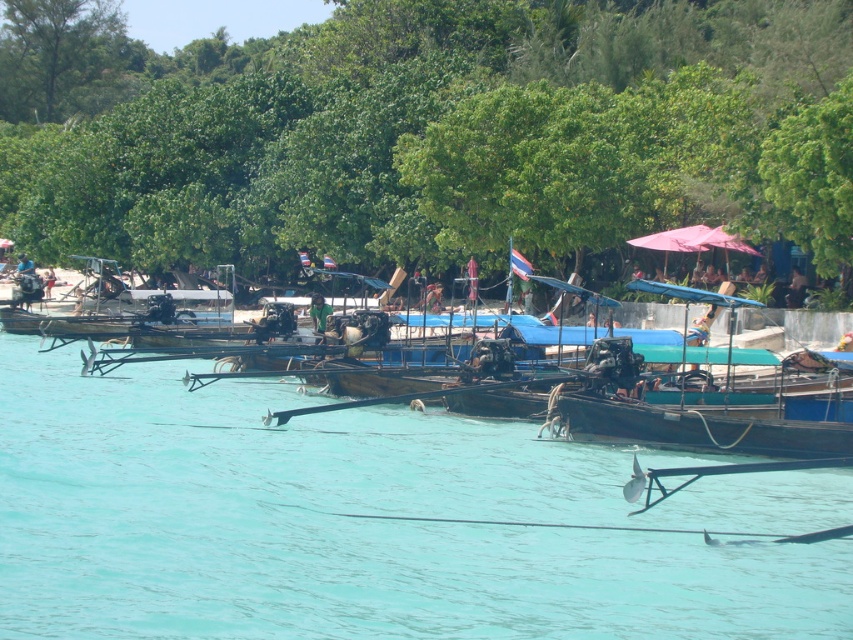
Is pink fabric umbrella at upper center wider than green fabric person at center?

Indeed, pink fabric umbrella at upper center has a greater width compared to green fabric person at center.

Who is taller, pink fabric umbrella at upper center or green fabric person at center?

With more height is green fabric person at center.

Locate an element on the screen. Image resolution: width=853 pixels, height=640 pixels. pink fabric umbrella at upper center is located at coordinates (715, 241).

Between point (416, 13) and point (677, 621), which one is positioned behind?

Point (416, 13)

Which is behind, point (258, 112) or point (344, 480)?

Point (258, 112)

Locate an element on the screen. This screenshot has width=853, height=640. green leafy trees at center is located at coordinates (430, 131).

Does transparent wooden boats at center lie in front of dark brown wooden boat at center?

Yes.

Between transparent wooden boats at center and dark brown wooden boat at center, which one is positioned higher?

dark brown wooden boat at center is higher up.

What are the coordinates of `transparent wooden boats at center` in the screenshot? It's located at (369, 522).